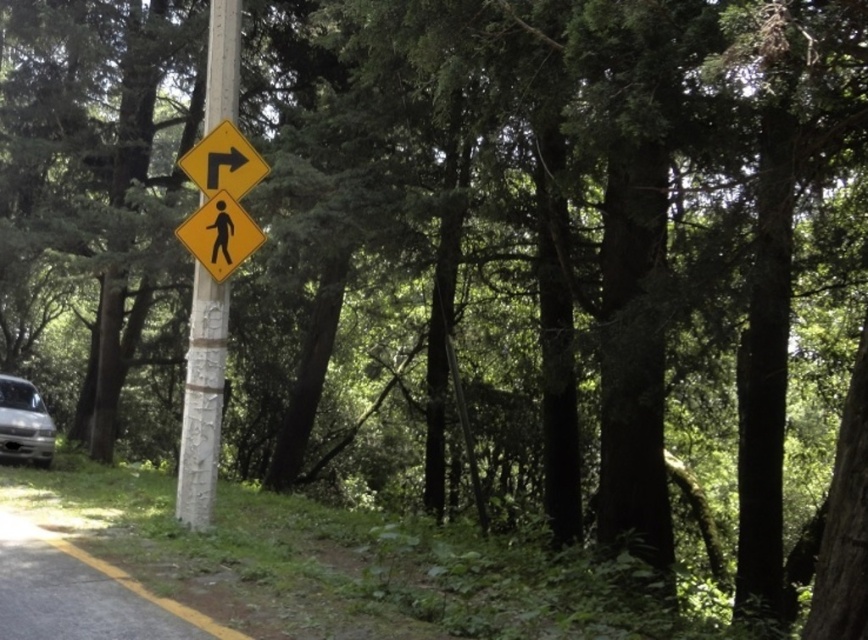
You are driving a car and see the yellow plastic pedestrian sign at upper center and the silver metallic van at lower left in your view. Which object is nearer to you?

The yellow plastic pedestrian sign at upper center is closer to the viewer than the silver metallic van at lower left.

You are driving a car and see the white painted wood pole at center and the silver metallic van at lower left in your view. Which object is closer to the right side of your vehicle?

The white painted wood pole at center is positioned on the right side of the silver metallic van at lower left, so the pole is closer to the right side of the vehicle.